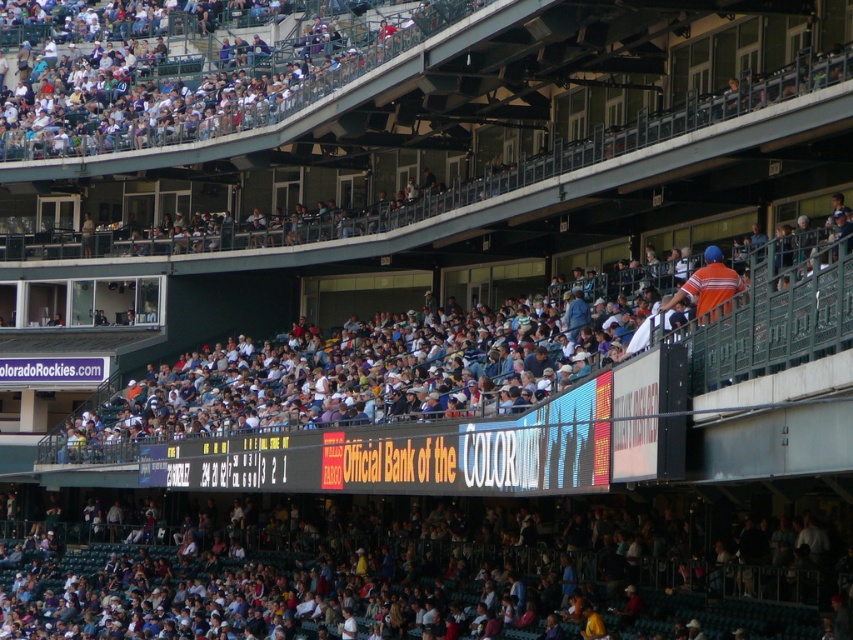
You are a spectator sitting in the stands and want to move to the row behind you to get a better view. Which seats should you move towards, the dark blue seats at lower center or the white plastic seats at upper center?

You should move towards the white plastic seats at upper center because the dark blue seats at lower center are closer to you, so moving behind would mean going towards the white plastic seats at upper center which are further away.

You are a drone operator trying to capture aerial footage of the game. Your drone can fly up to 15 meters. If you are currently positioned at the dark blue seats at lower center, can you fly your drone to the white plastic seats at upper center without exceeding its maximum flight range?

The distance between the dark blue seats at lower center and the white plastic seats at upper center is 20.00 meters. Since the drone can only fly up to 15 meters, it cannot reach the white plastic seats at upper center without exceeding its maximum flight range.